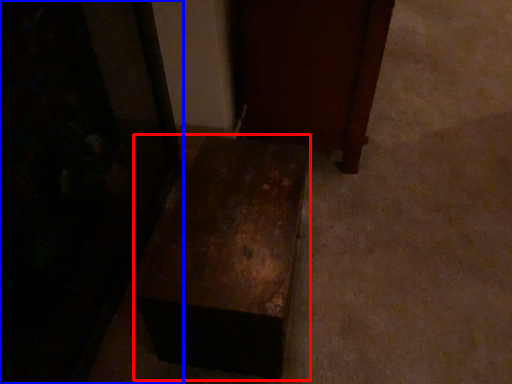
Question: Which point is closer to the camera, furniture (highlighted by a red box) or furniture (highlighted by a blue box)?

Choices:
 (A) furniture
 (B) furniture

Answer: (B)